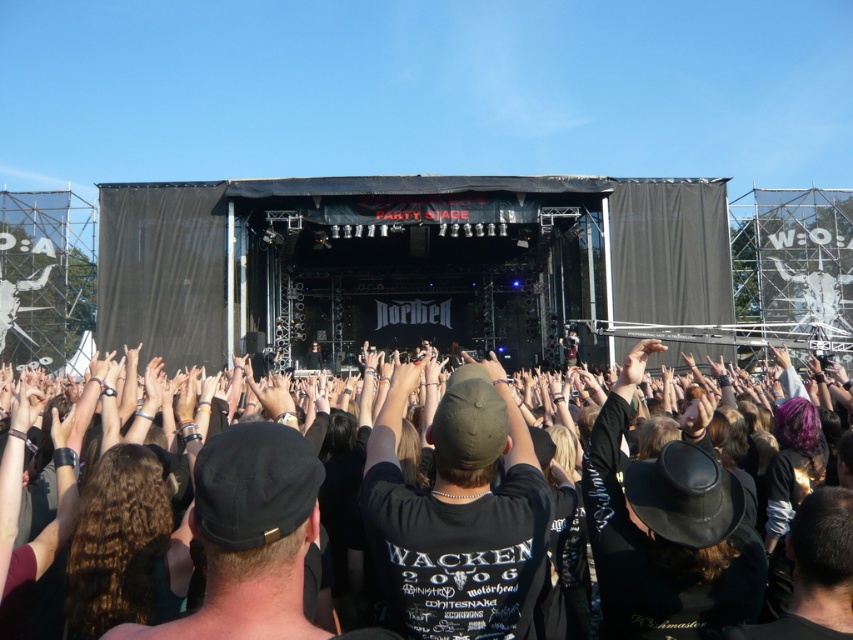
You are standing at the point labeled point (151, 557) and want to walk to the point labeled point (527, 552). Which direction should you move to get closer to your destination?

You should move away from the camera because point (151, 557) is closer to the camera than point (527, 552).

You are a photographer at the concert and want to capture a photo of the black matte cap at center without the black fabric crowd at center blocking it. Is this possible?

The black fabric crowd at center is above the black matte cap at center, so it will block the view. You cannot capture the black matte cap at center without the black fabric crowd at center blocking it.